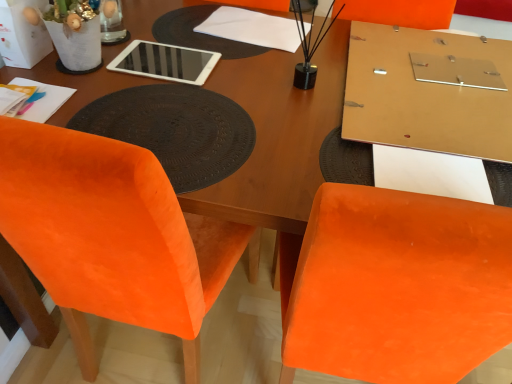
Locate an element on the screen. The image size is (512, 384). vacant space in front of white glossy tablet at upper center is located at coordinates (106, 90).